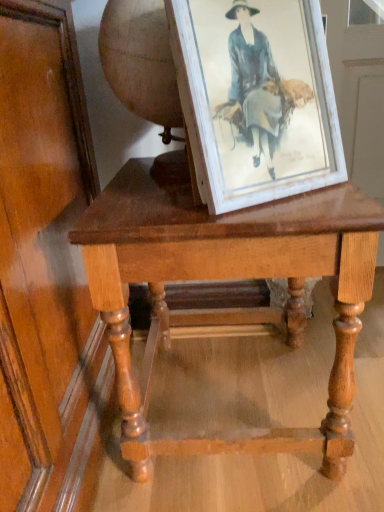
This screenshot has height=512, width=384. Find the location of `free space in front of white distressed wood picture frame at center`. free space in front of white distressed wood picture frame at center is located at coordinates (284, 213).